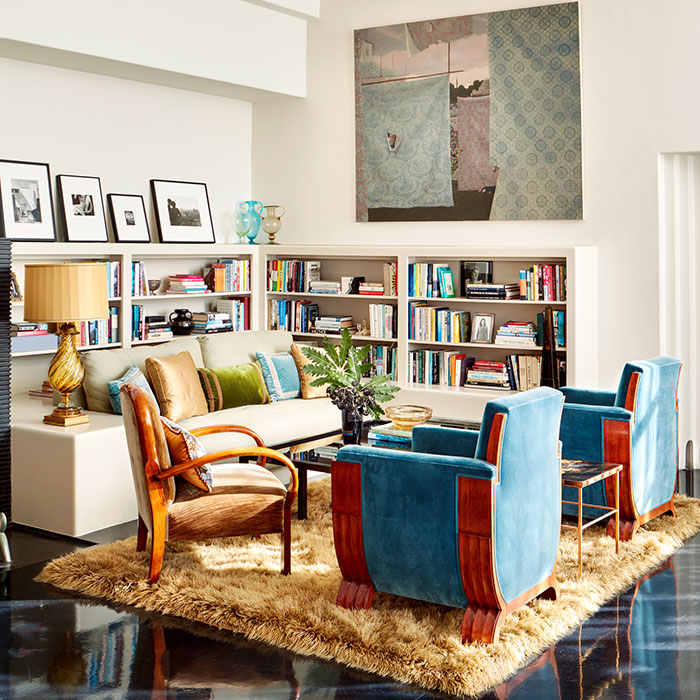
I want to click on pillows, so click(180, 452), click(131, 376), click(241, 382), click(288, 372), click(309, 379).